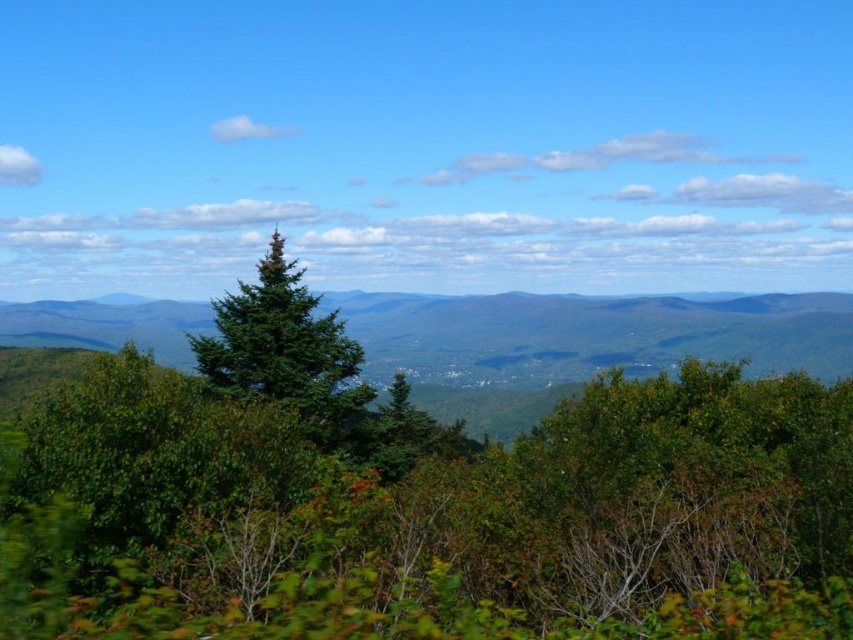
Is green leafy tree at center to the left of green leafy trees at center from the viewer's perspective?

Incorrect, green leafy tree at center is not on the left side of green leafy trees at center.

Is green leafy tree at center to the right of green leafy trees at center from the viewer's perspective?

Indeed, green leafy tree at center is positioned on the right side of green leafy trees at center.

Does point (351, 586) come behind point (376, 340)?

No, it is not.

Where is `green leafy tree at center`? This screenshot has width=853, height=640. green leafy tree at center is located at coordinates (431, 518).

Is green leafy tree at center above green matte tree at center?

No, green leafy tree at center is not above green matte tree at center.

Who is higher up, green leafy tree at center or green matte tree at center?

green matte tree at center is higher up.

Which is in front, point (73, 616) or point (216, 376)?

Point (73, 616)

Find the location of a particular element. Image resolution: width=853 pixels, height=640 pixels. green leafy tree at center is located at coordinates (431, 518).

Can you confirm if green leafy trees at center is positioned above green matte tree at center?

No, green leafy trees at center is not above green matte tree at center.

At what (x,y) coordinates should I click in order to perform the action: click on green leafy trees at center. Please return your answer as a coordinate pair (x, y). The width and height of the screenshot is (853, 640). Looking at the image, I should click on (579, 342).

Does point (650, 348) lie in front of point (347, 384)?

No, (650, 348) is further to viewer.

Locate an element on the screen. The image size is (853, 640). green leafy trees at center is located at coordinates (579, 342).